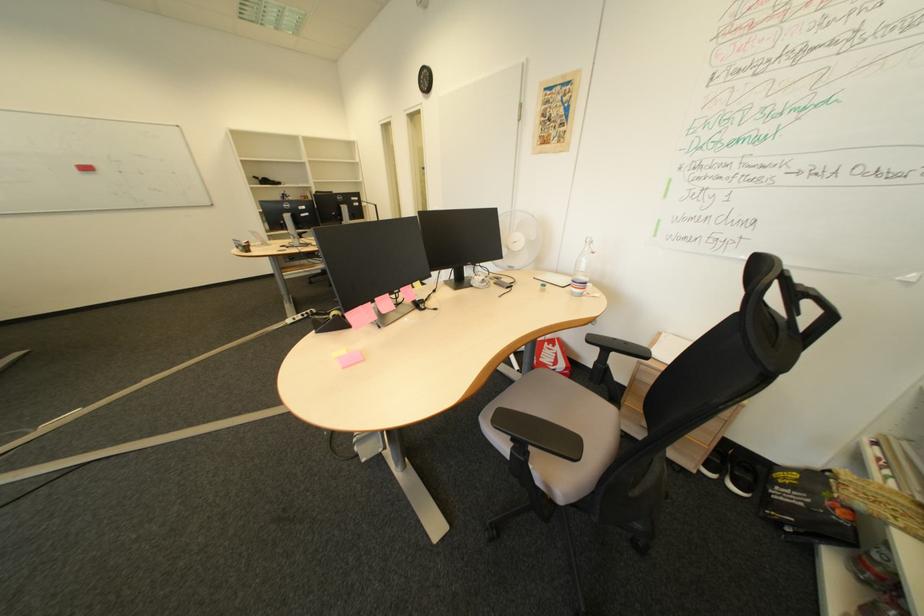
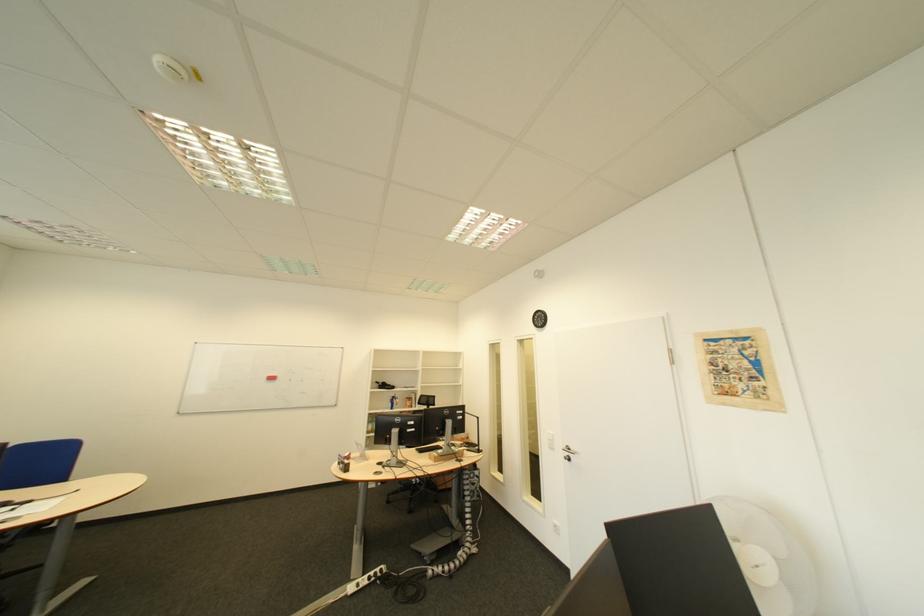
The point at (x=274, y=180) is marked in the first image. Where is the corresponding point in the second image?

(393, 385)